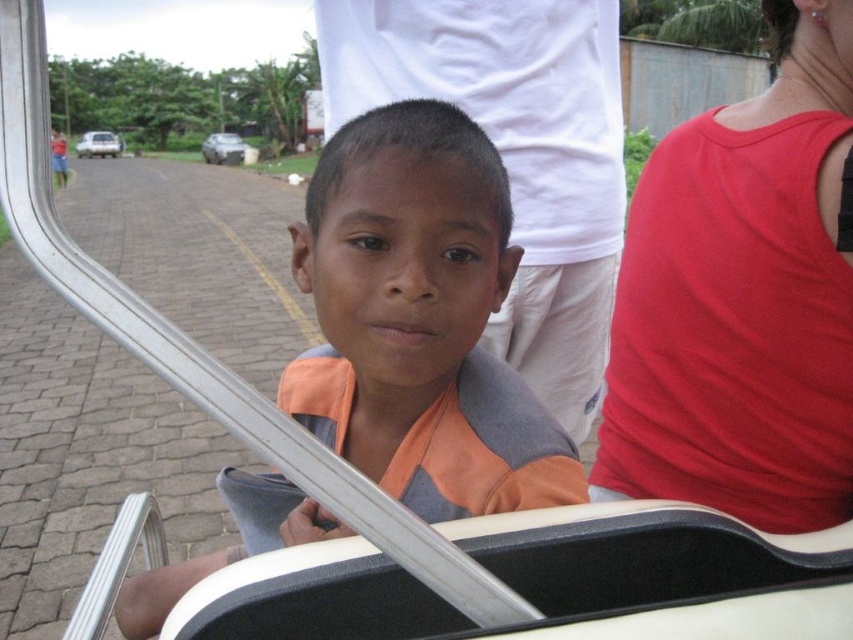
Question: Which of the following is the farthest from the observer?

Choices:
 (A) white glossy car at upper left
 (B) orange fabric shirt at center
 (C) silver metallic car at upper left
 (D) red smooth tank top at right

Answer: (A)

Question: Is orange fabric shirt at center thinner than white glossy car at upper left?

Choices:
 (A) no
 (B) yes

Answer: (B)

Question: Which point is closer to the camera?

Choices:
 (A) (138, 632)
 (B) (108, 148)

Answer: (A)

Question: Can you confirm if red smooth tank top at right is positioned to the left of orange fabric shirt at center?

Choices:
 (A) yes
 (B) no

Answer: (B)

Question: Does orange fabric shirt at center appear on the right side of white glossy car at upper left?

Choices:
 (A) yes
 (B) no

Answer: (A)

Question: Among these objects, which one is farthest from the camera?

Choices:
 (A) orange fabric shirt at center
 (B) silver metallic car at upper left

Answer: (B)